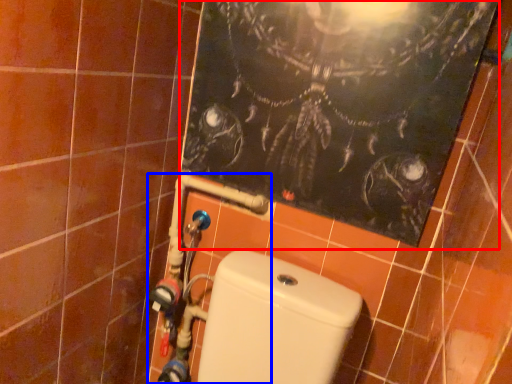
Question: Which object appears closest to the camera in this image, bulletin board (highlighted by a red box) or water pipe (highlighted by a blue box)?

Choices:
 (A) bulletin board
 (B) water pipe

Answer: (A)